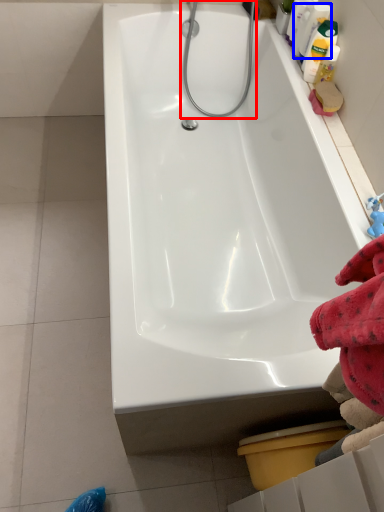
Question: Which point is further to the camera, shower (highlighted by a red box) or cleaning product (highlighted by a blue box)?

Choices:
 (A) shower
 (B) cleaning product

Answer: (A)